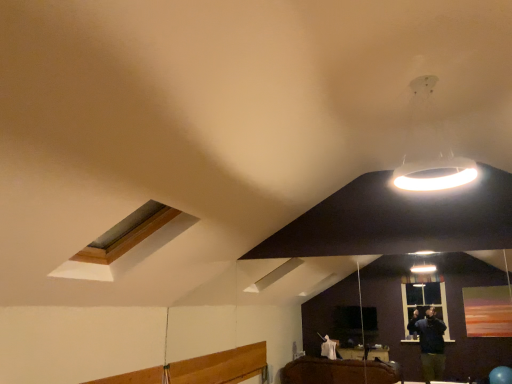
Question: Is white glossy ring light at upper right in front of or behind wooden-framed skylight at upper left in the image?

Choices:
 (A) behind
 (B) front

Answer: (B)

Question: From a real-world perspective, relative to wooden-framed skylight at upper left, is white glossy ring light at upper right vertically above or below?

Choices:
 (A) below
 (B) above

Answer: (B)

Question: Visually, is white glossy ring light at upper right positioned to the left or to the right of wooden-framed skylight at upper left?

Choices:
 (A) right
 (B) left

Answer: (A)

Question: Is wooden-framed skylight at upper left inside the boundaries of white glossy ring light at upper right, or outside?

Choices:
 (A) outside
 (B) inside

Answer: (A)

Question: From the image's perspective, is wooden-framed skylight at upper left above or below white glossy ring light at upper right?

Choices:
 (A) below
 (B) above

Answer: (A)

Question: Is wooden-framed skylight at upper left in front of or behind white glossy ring light at upper right in the image?

Choices:
 (A) behind
 (B) front

Answer: (A)

Question: Does point (126, 236) appear closer or farther from the camera than point (442, 137)?

Choices:
 (A) farther
 (B) closer

Answer: (B)